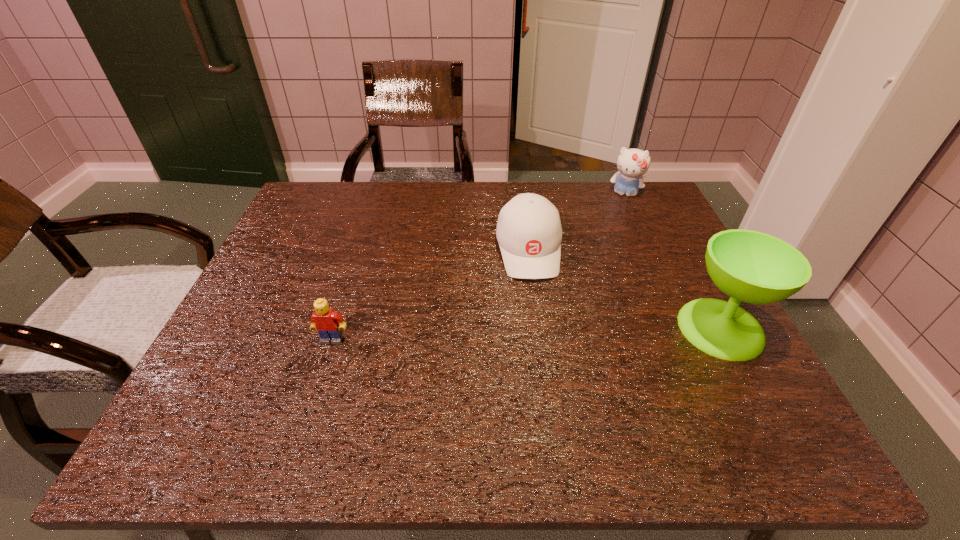
At what (x,y) coordinates should I click in order to perform the action: click on free space on the desktop that is between the Lego and the wineglass and is positioned on the front-facing side of the third object from right to left. Please return your answer as a coordinate pair (x, y). This screenshot has height=540, width=960. Looking at the image, I should click on (542, 334).

Where is `free space on the desktop that is between the Lego and the wineglass and is positioned on the front-facing side of the farthest object`? The height and width of the screenshot is (540, 960). free space on the desktop that is between the Lego and the wineglass and is positioned on the front-facing side of the farthest object is located at coordinates (583, 333).